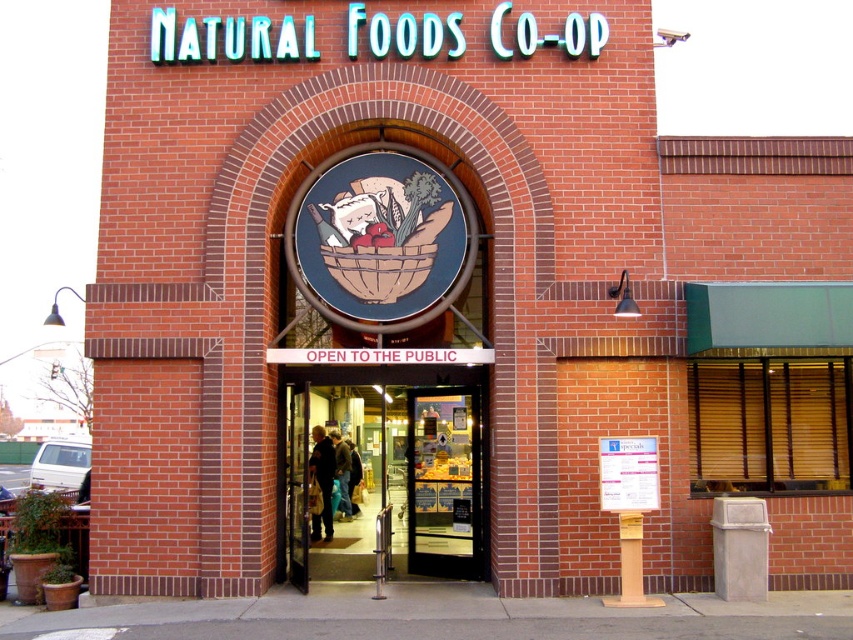
Between point (328, 372) and point (630, 492), which one is positioned in front?

Point (630, 492)

Is glass door at center smaller than white paper sign at center?

Yes.

Is point (442, 547) positioned behind point (646, 464)?

Yes.

Where is `glass door at center`? Image resolution: width=853 pixels, height=640 pixels. glass door at center is located at coordinates (399, 467).